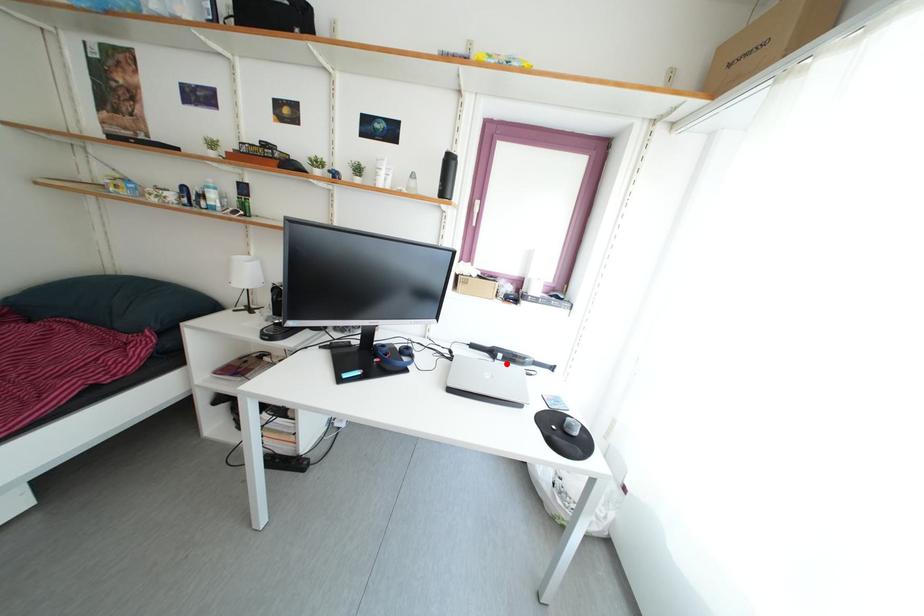
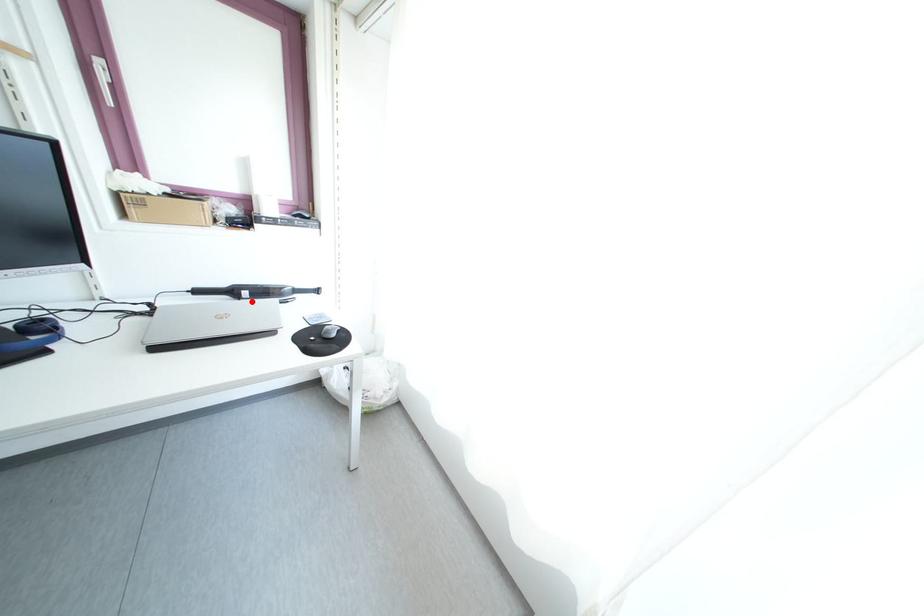
I am providing you with two images of the same scene from different viewpoints. A red point is marked on the first image and another point is marked on the second image. Does the point marked in image1 correspond to the same location as the one in image2?

Yes